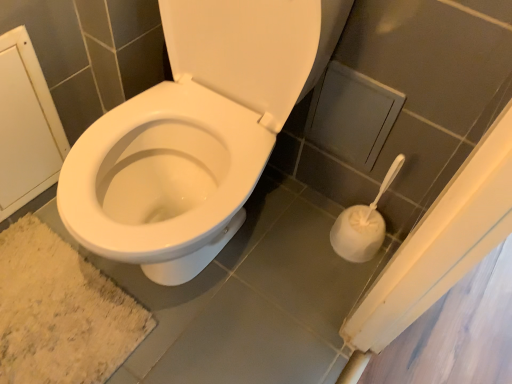
Question: Is the position of white matte toilet brush at lower right more distant than that of beige shaggy bath mat at lower left?

Choices:
 (A) yes
 (B) no

Answer: (B)

Question: From a real-world perspective, is white matte toilet brush at lower right positioned under beige shaggy bath mat at lower left based on gravity?

Choices:
 (A) no
 (B) yes

Answer: (A)

Question: Does white matte toilet brush at lower right have a greater height compared to beige shaggy bath mat at lower left?

Choices:
 (A) yes
 (B) no

Answer: (A)

Question: From the image's perspective, is white matte toilet brush at lower right located above beige shaggy bath mat at lower left?

Choices:
 (A) yes
 (B) no

Answer: (A)

Question: Is beige shaggy bath mat at lower left completely or partially inside white matte toilet brush at lower right?

Choices:
 (A) no
 (B) yes

Answer: (A)

Question: Does white matte toilet brush at lower right have a lesser width compared to beige shaggy bath mat at lower left?

Choices:
 (A) no
 (B) yes

Answer: (B)

Question: Is beige shaggy bath mat at lower left facing towards white matte toilet brush at lower right?

Choices:
 (A) yes
 (B) no

Answer: (B)

Question: Does beige shaggy bath mat at lower left have a larger size compared to white matte toilet brush at lower right?

Choices:
 (A) yes
 (B) no

Answer: (B)

Question: Considering the relative sizes of beige shaggy bath mat at lower left and white matte toilet brush at lower right in the image provided, is beige shaggy bath mat at lower left thinner than white matte toilet brush at lower right?

Choices:
 (A) no
 (B) yes

Answer: (A)

Question: From the image's perspective, is beige shaggy bath mat at lower left over white matte toilet brush at lower right?

Choices:
 (A) yes
 (B) no

Answer: (B)

Question: Considering the relative positions of beige shaggy bath mat at lower left and white matte toilet brush at lower right in the image provided, is beige shaggy bath mat at lower left to the left of white matte toilet brush at lower right from the viewer's perspective?

Choices:
 (A) yes
 (B) no

Answer: (A)

Question: Is beige shaggy bath mat at lower left further to camera compared to white matte toilet brush at lower right?

Choices:
 (A) yes
 (B) no

Answer: (A)

Question: Considering the relative positions of white matte toilet brush at lower right and beige shaggy bath mat at lower left in the image provided, is white matte toilet brush at lower right to the left or to the right of beige shaggy bath mat at lower left?

Choices:
 (A) right
 (B) left

Answer: (A)